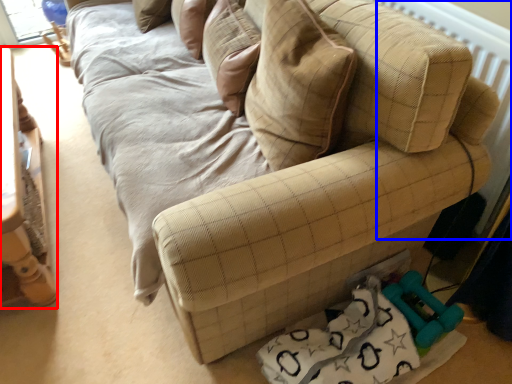
Question: Which of the following is the farthest to the observer, furniture (highlighted by a red box) or radiator (highlighted by a blue box)?

Choices:
 (A) furniture
 (B) radiator

Answer: (B)